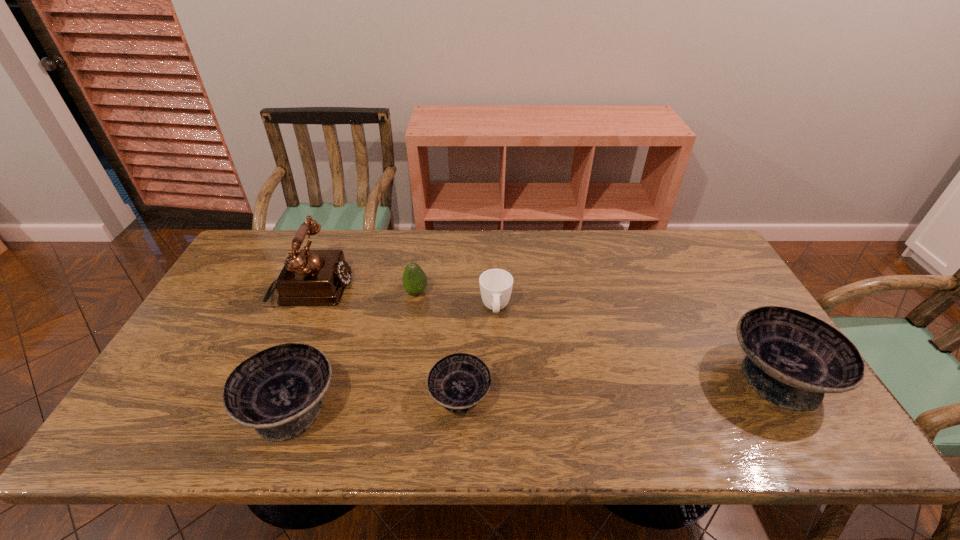
The height and width of the screenshot is (540, 960). Identify the location of unoccupied area between the second tallest bowl and the shortest bowl. [375, 402].

The height and width of the screenshot is (540, 960). I want to click on empty location between the third object from left to right and the shortest object, so click(x=438, y=345).

Find the location of a particular element. vacant region between the second bowl from left to right and the telephone is located at coordinates (386, 343).

Identify which object is located as the third nearest to the telephone. Please provide its 2D coordinates. Your answer should be formatted as a tuple, i.e. [(x, y)], where the tuple contains the x and y coordinates of a point satisfying the conditions above.

[(458, 382)]

Identify the location of object that is the third nearest to the tallest object. The width and height of the screenshot is (960, 540). (458, 382).

I want to click on bowl that is the closest to the shortest bowl, so click(278, 391).

Locate an element on the screen. This screenshot has width=960, height=540. bowl object that ranks as the closest to the shortest object is located at coordinates (278, 391).

Image resolution: width=960 pixels, height=540 pixels. I want to click on free point that satisfies the following two spatial constraints: 1. on the back side of the leftmost bowl; 2. on the dial of the telephone, so click(334, 290).

This screenshot has height=540, width=960. Find the location of `vacant region that satisfies the following two spatial constraints: 1. on the dial of the fourth object from right to left; 2. on the left side of the telephone`. vacant region that satisfies the following two spatial constraints: 1. on the dial of the fourth object from right to left; 2. on the left side of the telephone is located at coordinates (310, 293).